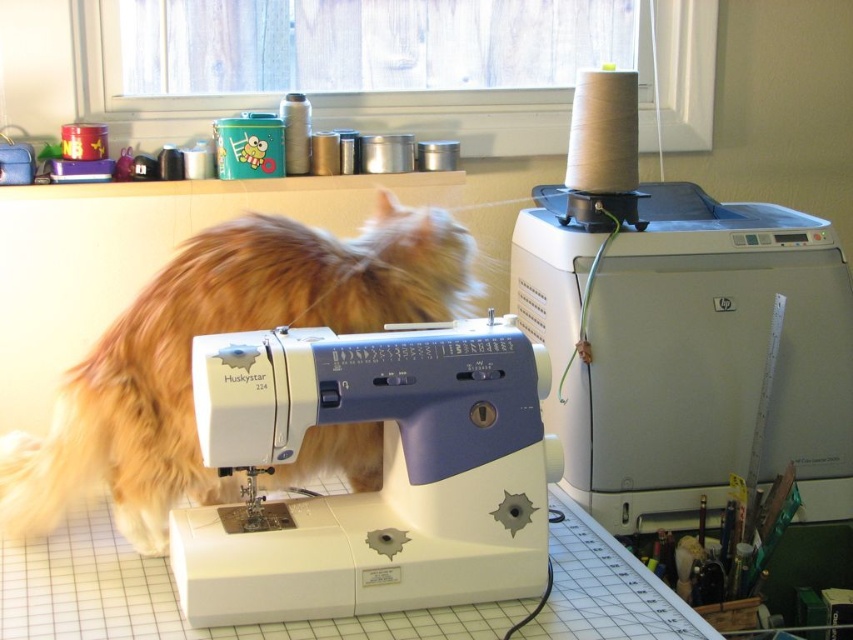
Based on the photo, you are a cat owner who wants to ensure your cat stays safe while you work on the sewing machine. Which sewing machine is closer to the cat, the white plastic sewing machine at upper right or the white plastic sewing machine at center?

The white plastic sewing machine at upper right is closer to the cat because the white plastic sewing machine at center is behind it, making the upper right one nearer.

You are a customer comparing two sewing machines in a store. You see a white plastic sewing machine at upper right and a white plastic sewing machine at center. Which one is bigger?

The white plastic sewing machine at upper right is larger than the white plastic sewing machine at center.